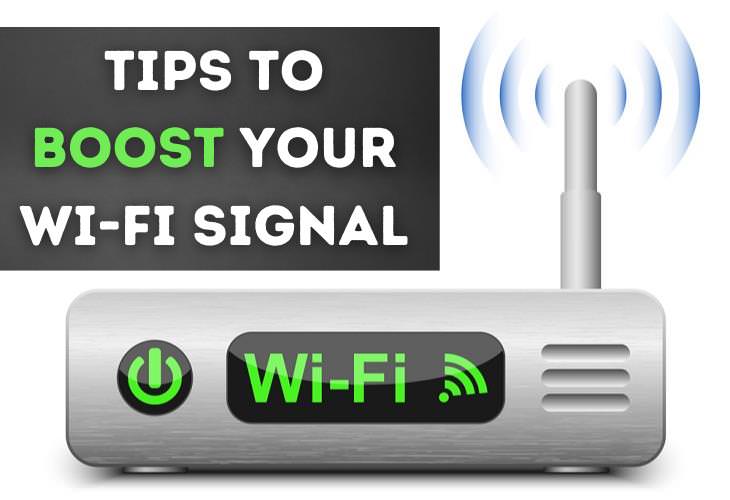
Image resolution: width=730 pixels, height=500 pixels. Identify the location of router. (442, 446).